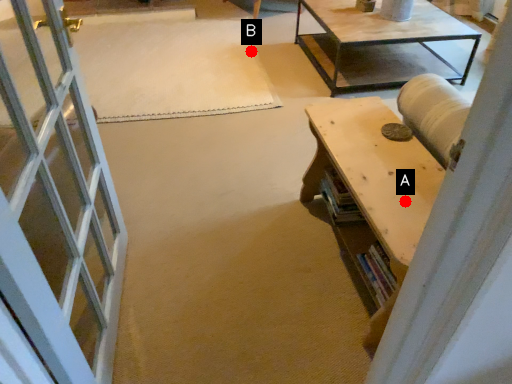
Question: Two points are circled on the image, labeled by A and B beside each circle. Which point appears farthest from the camera in this image?

Choices:
 (A) A is further
 (B) B is further

Answer: (B)